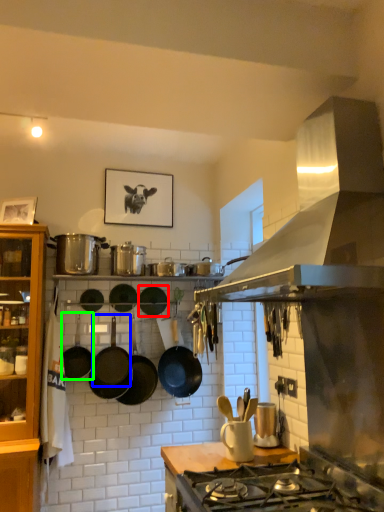
Question: Based on their relative distances, which object is farther from wok (highlighted by a red box)? Choose from wok (highlighted by a blue box) and wok (highlighted by a green box).

Choices:
 (A) wok
 (B) wok

Answer: (B)